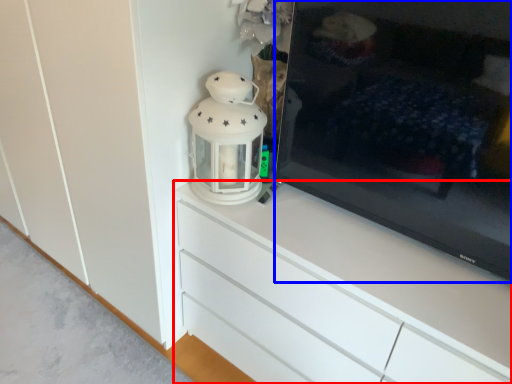
Question: Which object is closer to the camera taking this photo, chest of drawers (highlighted by a red box) or television (highlighted by a blue box)?

Choices:
 (A) chest of drawers
 (B) television

Answer: (B)